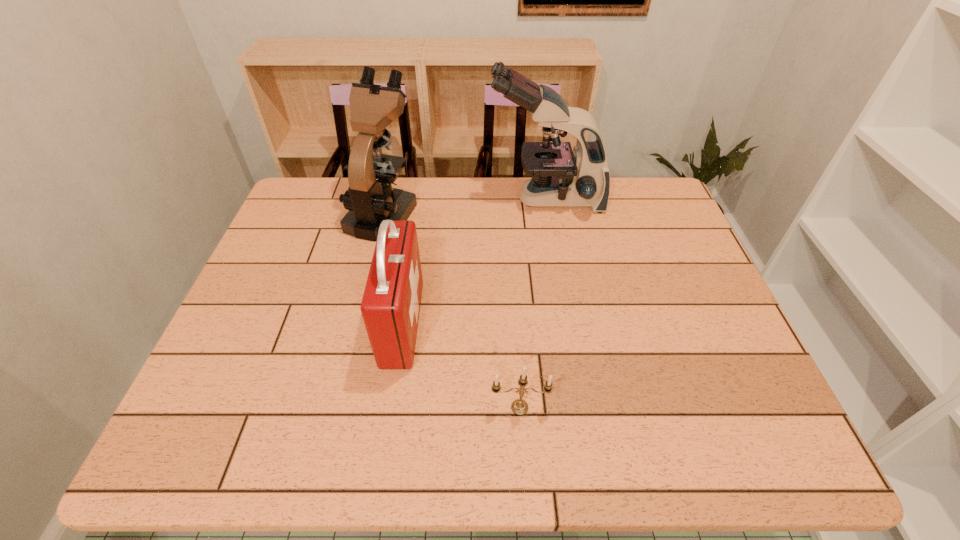
Locate an element on the screen. The width and height of the screenshot is (960, 540). free space that satisfies the following two spatial constraints: 1. on the front face of the second shortest object; 2. on the left side of the shortest object is located at coordinates [390, 408].